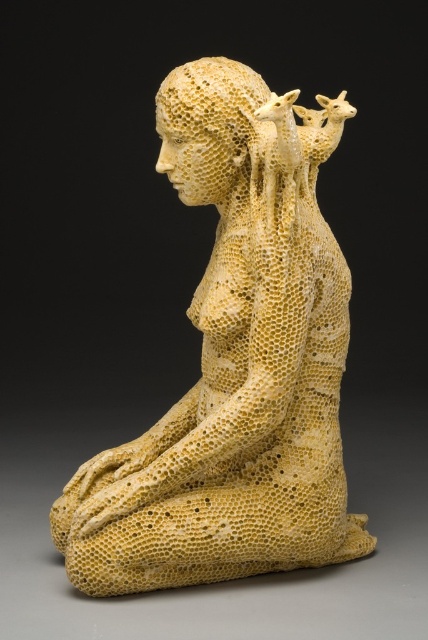
Consider the image. Who is taller, yellow honeycomb sculpture at center or honeycomb-patterned head at center?

yellow honeycomb sculpture at center is taller.

Image resolution: width=428 pixels, height=640 pixels. Find the location of `yellow honeycomb sculpture at center`. yellow honeycomb sculpture at center is located at coordinates (234, 364).